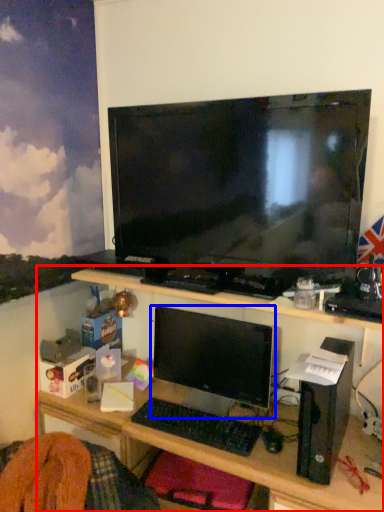
Question: Among these objects, which one is nearest to the camera, desk (highlighted by a red box) or computer monitor (highlighted by a blue box)?

Choices:
 (A) desk
 (B) computer monitor

Answer: (A)